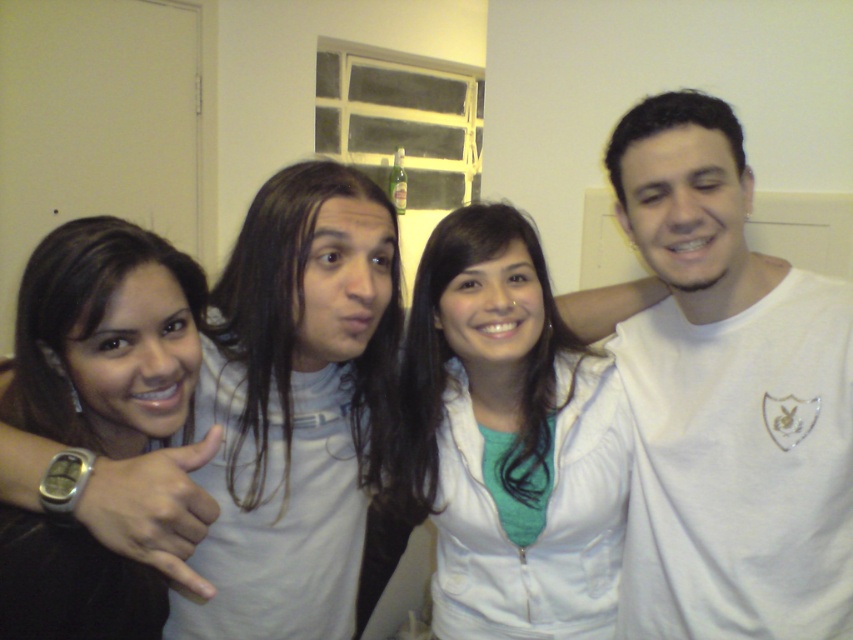
Can you confirm if white matte t-shirt at center is positioned to the left of white matte jacket at center?

In fact, white matte t-shirt at center is to the right of white matte jacket at center.

Does point (664, 554) come closer to viewer compared to point (570, 429)?

Yes, point (664, 554) is closer to viewer.

You are a GUI agent. You are given a task and a screenshot of the screen. Output one action in this format:
    pyautogui.click(x=<x>, y=<y>)
    Task: Click on the white matte t-shirt at center
    
    Given the screenshot: What is the action you would take?
    pyautogui.click(x=727, y=400)

In order to click on white matte t-shirt at center in this screenshot , I will do `click(727, 400)`.

Which of these two, white matte jacket at center or brown hair at upper left, stands taller?

With more height is white matte jacket at center.

Who is more distant from viewer, (521, 316) or (41, 598)?

Positioned behind is point (521, 316).

Identify the location of white matte jacket at center. (508, 440).

How distant is white matte t-shirt at center from brown hair at upper left?

white matte t-shirt at center and brown hair at upper left are 27.24 inches apart from each other.

Is white matte t-shirt at center positioned behind brown hair at upper left?

Yes, white matte t-shirt at center is further from the viewer.

Who is more distant from viewer, (637, 432) or (28, 378)?

The point (637, 432) is more distant.

Find the location of `white matte t-shirt at center`. white matte t-shirt at center is located at coordinates (727, 400).